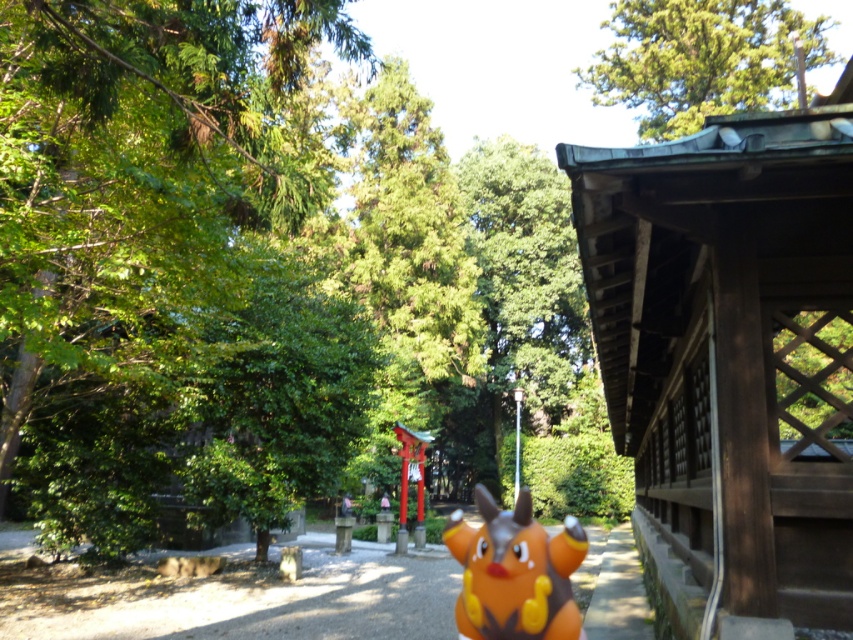
You are standing at point (511, 620) and want to walk to point (299, 611). Which direction should you face to move towards your destination?

You should face towards the front because point (299, 611) is behind point (511, 620), so moving forward from point (511, 620) will take you towards point (299, 611).

You are a visitor in the garden and want to place a new decorative item exactly at the center of the gravel pathway. The orange plastic toy at center is currently occupying the desired spot. Can you move it to a new location that is still within the garden but not on the gravel pathway?

The orange plastic toy at center is currently at point (x=233, y=596). Since the gravel pathway is in the midground, moving the toy to the foreground or background areas of the garden would keep it within the garden but off the pathway.